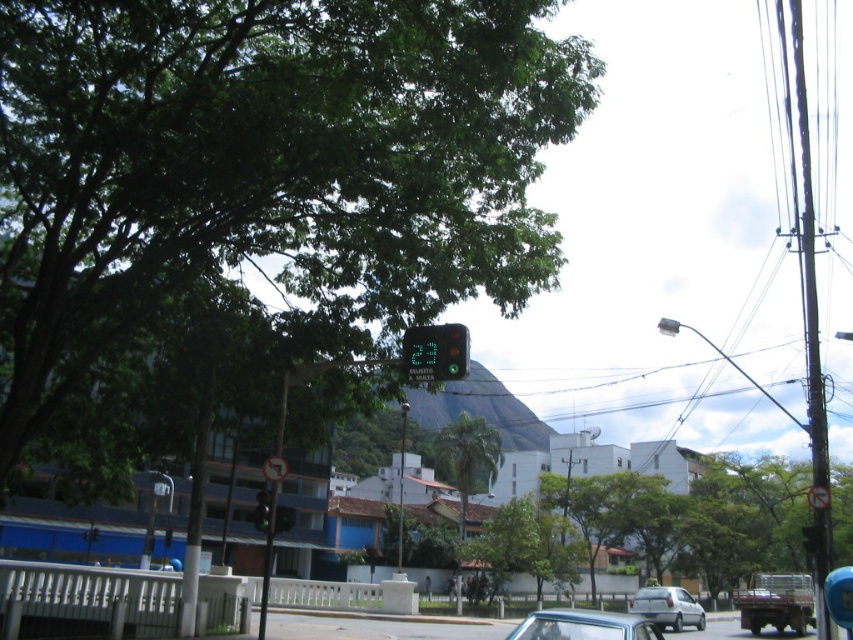
You are a pedestrian standing on the sidewalk and see both the green matte traffic light at center and the green glass traffic light at center. Which one is positioned more to the right side?

The green matte traffic light at center is positioned more to the right side than the green glass traffic light at center.

Consider the image. You are a delivery person trying to park your metallic silver car at lower center. There is a white plastic sign at center that you must not hit. Based on the scene, can you park your car without hitting the sign?

The metallic silver car at lower center is taller than the white plastic sign at center, so you can park the car without hitting the sign as the car is taller and would not collide with the sign during parking.